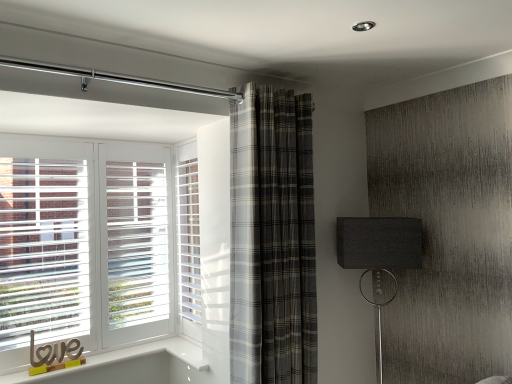
Question: Can you confirm if matte black lampshade at right is thinner than plaid fabric curtain at center?

Choices:
 (A) no
 (B) yes

Answer: (A)

Question: Is plaid fabric curtain at center at the back of matte black lampshade at right?

Choices:
 (A) yes
 (B) no

Answer: (B)

Question: From the image's perspective, does matte black lampshade at right appear higher than plaid fabric curtain at center?

Choices:
 (A) yes
 (B) no

Answer: (B)

Question: Does matte black lampshade at right have a greater height compared to plaid fabric curtain at center?

Choices:
 (A) yes
 (B) no

Answer: (B)

Question: Is matte black lampshade at right bigger than plaid fabric curtain at center?

Choices:
 (A) no
 (B) yes

Answer: (A)

Question: Based on their sizes in the image, would you say plaid fabric curtain at center is bigger or smaller than matte black lampshade at right?

Choices:
 (A) small
 (B) big

Answer: (B)

Question: Is point (239, 274) closer or farther from the camera than point (396, 230)?

Choices:
 (A) closer
 (B) farther

Answer: (A)

Question: Is plaid fabric curtain at center situated inside matte black lampshade at right or outside?

Choices:
 (A) inside
 (B) outside

Answer: (B)

Question: In terms of width, does plaid fabric curtain at center look wider or thinner when compared to matte black lampshade at right?

Choices:
 (A) wide
 (B) thin

Answer: (B)

Question: Is white textured screen door at center in front of or behind plaid fabric curtain at center in the image?

Choices:
 (A) front
 (B) behind

Answer: (B)

Question: Is white textured screen door at center taller or shorter than plaid fabric curtain at center?

Choices:
 (A) tall
 (B) short

Answer: (B)

Question: Would you say white textured screen door at center is inside or outside plaid fabric curtain at center?

Choices:
 (A) inside
 (B) outside

Answer: (B)

Question: Considering the positions of point (196, 324) and point (252, 225), is point (196, 324) closer or farther from the camera than point (252, 225)?

Choices:
 (A) closer
 (B) farther

Answer: (B)

Question: In terms of height, does plaid fabric curtain at center look taller or shorter compared to white textured screen door at center?

Choices:
 (A) short
 (B) tall

Answer: (B)

Question: Looking at their shapes, would you say plaid fabric curtain at center is wider or thinner than white textured screen door at center?

Choices:
 (A) thin
 (B) wide

Answer: (B)